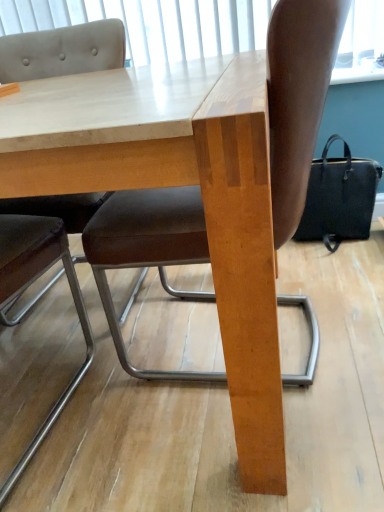
Question: Does point (350, 238) appear closer or farther from the camera than point (261, 312)?

Choices:
 (A) closer
 (B) farther

Answer: (B)

Question: From the image's perspective, is black fabric bag at right located above or below wooden table at center?

Choices:
 (A) above
 (B) below

Answer: (A)

Question: Estimate the real-world distances between objects in this image. Which object is farther from the white matte window screen at upper center?

Choices:
 (A) black fabric bag at right
 (B) brown leather chair at center, the 1th chair positioned from the right
 (C) wooden table at center
 (D) brown leather chair at upper left, the 1th chair viewed from the left

Answer: (C)

Question: Which of these objects is positioned farthest from the black fabric bag at right?

Choices:
 (A) brown leather chair at upper left, the 1th chair viewed from the left
 (B) brown leather chair at center, the 1th chair positioned from the right
 (C) wooden table at center
 (D) white matte window screen at upper center

Answer: (A)